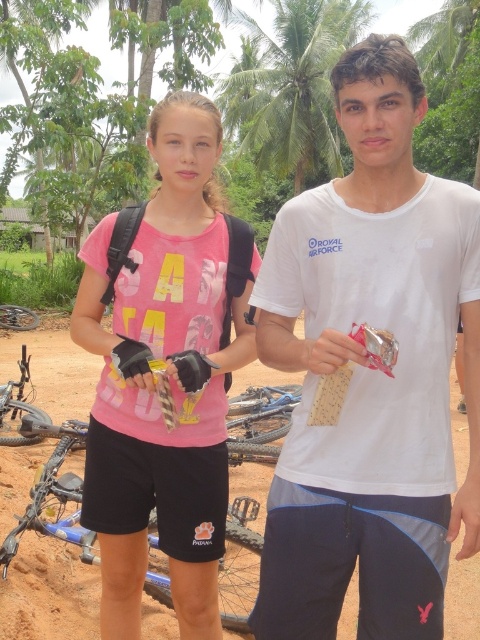
Question: Among these points, which one is nearest to the camera?

Choices:
 (A) (292, 109)
 (B) (260, 481)

Answer: (B)

Question: Considering the relative positions of pink matte shirt at center and green leafy palm tree at upper center in the image provided, where is pink matte shirt at center located with respect to green leafy palm tree at upper center?

Choices:
 (A) left
 (B) right

Answer: (A)

Question: Does pink matte shirt at center appear under brown dirt track at center?

Choices:
 (A) yes
 (B) no

Answer: (B)

Question: Which object is the farthest from the green leafy palm tree at upper center?

Choices:
 (A) white cotton t-shirt at center
 (B) pink matte shirt at center

Answer: (A)

Question: Does white cotton t-shirt at center appear on the right side of pink matte shirt at center?

Choices:
 (A) yes
 (B) no

Answer: (A)

Question: Which point is closer to the camera taking this photo?

Choices:
 (A) (143, 476)
 (B) (337, 65)
 (C) (327, 13)

Answer: (B)